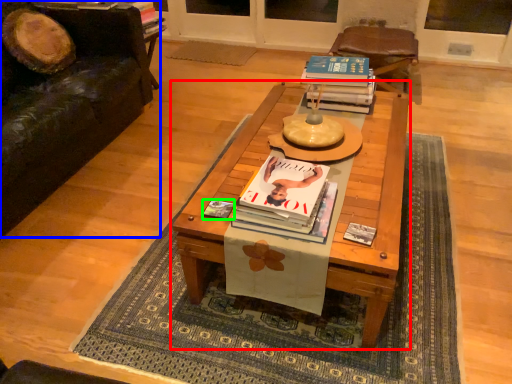
Question: Which object is positioned closest to coffee table (highlighted by a red box)? Select from studio couch (highlighted by a blue box) and magazine (highlighted by a green box).

Choices:
 (A) studio couch
 (B) magazine

Answer: (B)